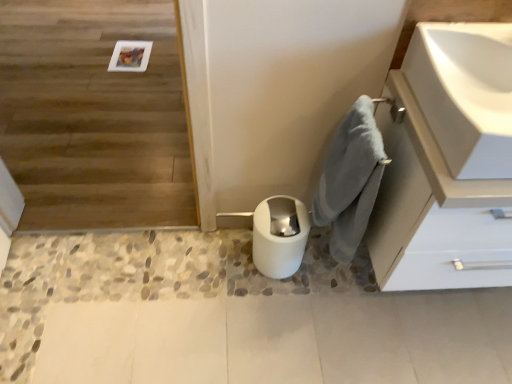
The width and height of the screenshot is (512, 384). What are the coordinates of `wooden floor at upper left` in the screenshot? It's located at (93, 116).

Image resolution: width=512 pixels, height=384 pixels. What do you see at coordinates (350, 180) in the screenshot?
I see `gray fluffy bath towel at lower right` at bounding box center [350, 180].

Measure the distance between white matte cabinet at upper right and camera.

The depth of white matte cabinet at upper right is 34.67 inches.

Find the location of a particular element. This screenshot has height=384, width=512. white glossy sink at upper right is located at coordinates (465, 93).

Consider the image. Are wooden floor at upper left and white glossy toilet bowl at lower center making contact?

No, wooden floor at upper left is not beside white glossy toilet bowl at lower center.

Who is bigger, wooden floor at upper left or white glossy toilet bowl at lower center?

wooden floor at upper left.

From a real-world perspective, is wooden floor at upper left physically located above or below white glossy toilet bowl at lower center?

In terms of real-world spatial position, wooden floor at upper left is above white glossy toilet bowl at lower center.

From the image's perspective, which is below, gray fluffy bath towel at lower right or white glossy sink at upper right?

From the image's view, gray fluffy bath towel at lower right is below.

Between gray fluffy bath towel at lower right and white glossy sink at upper right, which one has smaller size?

white glossy sink at upper right is smaller.

Based on the photo, which object is more forward, gray fluffy bath towel at lower right or white glossy sink at upper right?

white glossy sink at upper right is closer to the camera.

Is gray fluffy bath towel at lower right to the left of white glossy sink at upper right from the viewer's perspective?

Yes, gray fluffy bath towel at lower right is to the left of white glossy sink at upper right.

At what (x,y) coordinates should I click in order to perform the action: click on bath towel lying in front of the white glossy toilet bowl at lower center. Please return your answer as a coordinate pair (x, y). The image size is (512, 384). Looking at the image, I should click on (350, 180).

Could you tell me if white glossy toilet bowl at lower center is turned towards gray fluffy bath towel at lower right?

No, white glossy toilet bowl at lower center is not turned towards gray fluffy bath towel at lower right.

In the scene shown: Is white glossy toilet bowl at lower center positioned in front of gray fluffy bath towel at lower right?

No, white glossy toilet bowl at lower center is behind gray fluffy bath towel at lower right.

In the scene shown: Is gray fluffy bath towel at lower right completely or partially inside white glossy toilet bowl at lower center?

That's incorrect, gray fluffy bath towel at lower right is not inside white glossy toilet bowl at lower center.

From a real-world perspective, is white glossy sink at upper right on top of white glossy toilet bowl at lower center?

Yes, from a real-world perspective, white glossy sink at upper right is on top of white glossy toilet bowl at lower center.

Identify the location of sink above the white glossy toilet bowl at lower center (from the image's perspective). (465, 93).

Between white glossy sink at upper right and white glossy toilet bowl at lower center, which one is positioned behind?

white glossy toilet bowl at lower center is behind.

Looking at this image, from the image's perspective, does white matte cabinet at upper right appear lower than white glossy toilet bowl at lower center?

No, from the image's perspective, white matte cabinet at upper right is not beneath white glossy toilet bowl at lower center.

Does white matte cabinet at upper right touch white glossy toilet bowl at lower center?

white matte cabinet at upper right and white glossy toilet bowl at lower center are not in contact.

Considering the relative sizes of white matte cabinet at upper right and white glossy toilet bowl at lower center in the image provided, is white matte cabinet at upper right thinner than white glossy toilet bowl at lower center?

Incorrect, the width of white matte cabinet at upper right is not less than that of white glossy toilet bowl at lower center.

In the scene shown: Is wooden floor at upper left positioned behind white glossy sink at upper right?

Yes, it is.

Is white glossy sink at upper right a part of wooden floor at upper left?

Definitely not — white glossy sink at upper right is not inside wooden floor at upper left.

Can you tell me how much wooden floor at upper left and white glossy sink at upper right differ in facing direction?

The facing directions of wooden floor at upper left and white glossy sink at upper right are 0.432 degrees apart.

Is point (94, 137) less distant than point (452, 140)?

No, it is behind (452, 140).

From the picture: Is white matte cabinet at upper right with gray fluffy bath towel at lower right?

No, white matte cabinet at upper right is not beside gray fluffy bath towel at lower right.

Is white matte cabinet at upper right aimed at gray fluffy bath towel at lower right?

No, white matte cabinet at upper right is not aimed at gray fluffy bath towel at lower right.

Between white matte cabinet at upper right and gray fluffy bath towel at lower right, which one appears on the right side from the viewer's perspective?

Positioned to the right is white matte cabinet at upper right.

At what (x,y) coordinates should I click in order to perform the action: click on stairwell above the white glossy toilet bowl at lower center (from the image's perspective). Please return your answer as a coordinate pair (x, y). The width and height of the screenshot is (512, 384). Looking at the image, I should click on (93, 116).

Locate an element on the screen. Image resolution: width=512 pixels, height=384 pixels. bath towel below the white glossy sink at upper right (from a real-world perspective) is located at coordinates (350, 180).

Based on their spatial positions, is white matte cabinet at upper right or wooden floor at upper left further from gray fluffy bath towel at lower right?

Based on the image, wooden floor at upper left appears to be further to gray fluffy bath towel at lower right.

Considering their positions, is white matte cabinet at upper right positioned closer to white glossy toilet bowl at lower center than wooden floor at upper left?

Based on the image, white matte cabinet at upper right appears to be nearer to white glossy toilet bowl at lower center.

Which object lies further to the anchor point white glossy toilet bowl at lower center, gray fluffy bath towel at lower right or white matte cabinet at upper right?

Based on the image, white matte cabinet at upper right appears to be further to white glossy toilet bowl at lower center.

Estimate the real-world distances between objects in this image. Which object is further from white matte cabinet at upper right, white glossy sink at upper right or gray fluffy bath towel at lower right?

The object further to white matte cabinet at upper right is white glossy sink at upper right.

Estimate the real-world distances between objects in this image. Which object is closer to wooden floor at upper left, white glossy toilet bowl at lower center or white glossy sink at upper right?

white glossy toilet bowl at lower center is closer to wooden floor at upper left.

From the image, which object appears to be nearer to white glossy toilet bowl at lower center, white glossy sink at upper right or wooden floor at upper left?

white glossy sink at upper right is closer to white glossy toilet bowl at lower center.

Which object lies nearer to the anchor point wooden floor at upper left, white matte cabinet at upper right or gray fluffy bath towel at lower right?

gray fluffy bath towel at lower right.

From the image, which object appears to be farther from white matte cabinet at upper right, wooden floor at upper left or white glossy sink at upper right?

wooden floor at upper left is positioned further to the anchor white matte cabinet at upper right.

You are a GUI agent. You are given a task and a screenshot of the screen. Output one action in this format:
    pyautogui.click(x=<x>, y=<y>)
    Task: Click on the toilet bowl situated between wooden floor at upper left and gray fluffy bath towel at lower right from left to right
    
    Given the screenshot: What is the action you would take?
    pyautogui.click(x=279, y=236)

You are a GUI agent. You are given a task and a screenshot of the screen. Output one action in this format:
    pyautogui.click(x=<x>, y=<y>)
    Task: Click on the sink between white glossy toilet bowl at lower center and white matte cabinet at upper right in the horizontal direction
    
    Given the screenshot: What is the action you would take?
    pyautogui.click(x=465, y=93)

Where is `bath towel between wooden floor at upper left and white matte cabinet at upper right in the horizontal direction`? The height and width of the screenshot is (384, 512). bath towel between wooden floor at upper left and white matte cabinet at upper right in the horizontal direction is located at coordinates (350, 180).

The image size is (512, 384). I want to click on bath towel located between wooden floor at upper left and white glossy sink at upper right in the left-right direction, so click(350, 180).